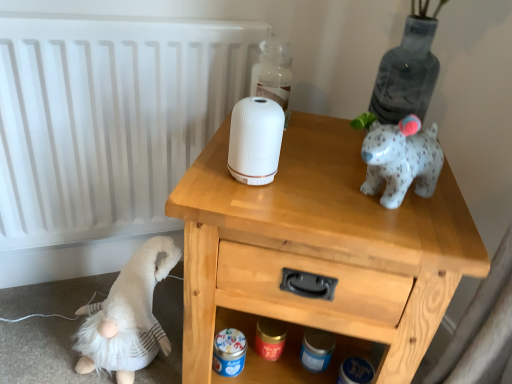
Question: Does transparent glass bottle at upper center have a greater width compared to wooden nightstand at upper center?

Choices:
 (A) no
 (B) yes

Answer: (A)

Question: Can you confirm if transparent glass bottle at upper center is shorter than wooden nightstand at upper center?

Choices:
 (A) yes
 (B) no

Answer: (A)

Question: Does transparent glass bottle at upper center appear on the left side of wooden nightstand at upper center?

Choices:
 (A) yes
 (B) no

Answer: (A)

Question: Is transparent glass bottle at upper center oriented away from wooden nightstand at upper center?

Choices:
 (A) yes
 (B) no

Answer: (B)

Question: Does transparent glass bottle at upper center have a lesser width compared to wooden nightstand at upper center?

Choices:
 (A) yes
 (B) no

Answer: (A)

Question: Considering the positions of transparent glass bottle at upper center and white matte radiator at upper left in the image, is transparent glass bottle at upper center taller or shorter than white matte radiator at upper left?

Choices:
 (A) short
 (B) tall

Answer: (A)

Question: Is point (286, 67) closer or farther from the camera than point (106, 61)?

Choices:
 (A) farther
 (B) closer

Answer: (A)

Question: From the image's perspective, is transparent glass bottle at upper center positioned above or below white matte radiator at upper left?

Choices:
 (A) below
 (B) above

Answer: (B)

Question: Is transparent glass bottle at upper center situated inside white matte radiator at upper left or outside?

Choices:
 (A) outside
 (B) inside

Answer: (A)

Question: Is white fluffy gnome at lower left inside or outside of white matte speaker at center?

Choices:
 (A) outside
 (B) inside

Answer: (A)

Question: Based on their positions, is white fluffy gnome at lower left located to the left or right of white matte speaker at center?

Choices:
 (A) right
 (B) left

Answer: (B)

Question: In the image, is white fluffy gnome at lower left positioned in front of or behind white matte speaker at center?

Choices:
 (A) front
 (B) behind

Answer: (B)

Question: Does point (152, 240) appear closer or farther from the camera than point (250, 182)?

Choices:
 (A) closer
 (B) farther

Answer: (B)

Question: Is white matte speaker at center inside or outside of transparent glass bottle at upper center?

Choices:
 (A) inside
 (B) outside

Answer: (B)

Question: Is white matte speaker at center bigger or smaller than transparent glass bottle at upper center?

Choices:
 (A) small
 (B) big

Answer: (A)